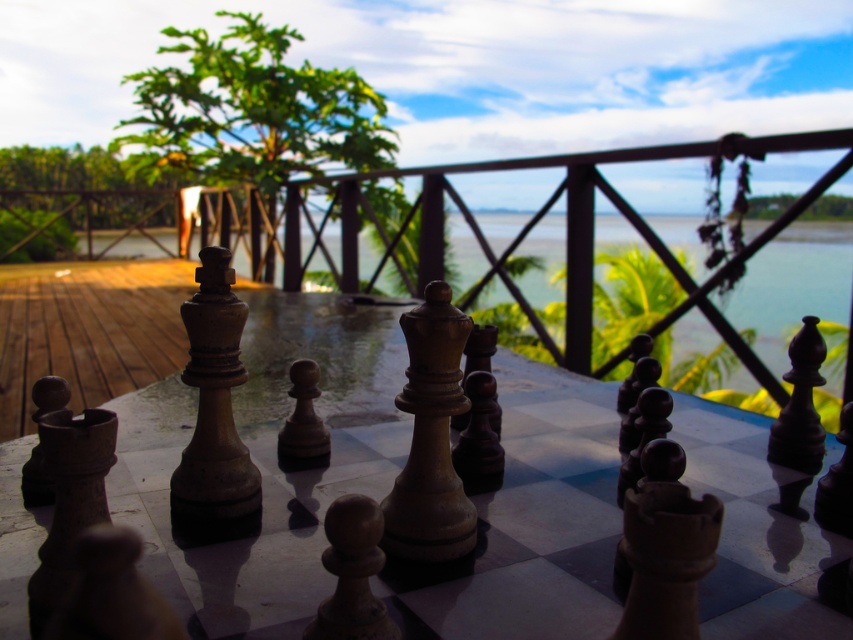
You are standing on a wooden deck overlooking a scenic tropical area. You see a point marked at coordinates (265, 464). According to the image, what object is located at that point?

The point at (265, 464) corresponds to the wooden chessboard at center.

You are a chess player standing on the deck and want to place a new chess piece on the wooden chessboard at center. However, there is transparent glass water at center above it. Can you place the piece directly on the chessboard without it getting wet?

The wooden chessboard at center is below transparent glass water at center, so the water is above it. Since the water is transparent and glass, it might be a cover or protective layer. Therefore, you can safely place the chess piece on the wooden chessboard at center without it getting wet as the glass likely prevents water from reaching the board.